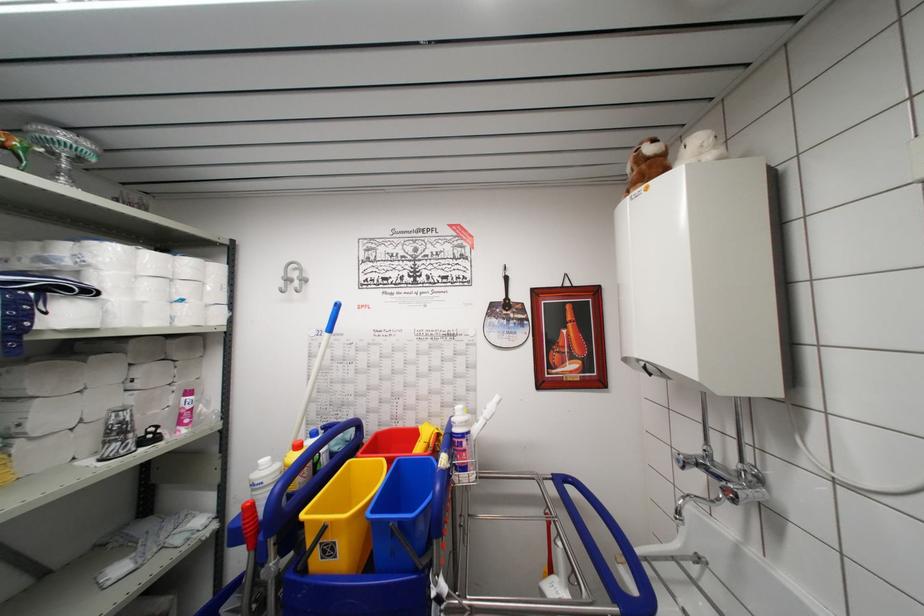
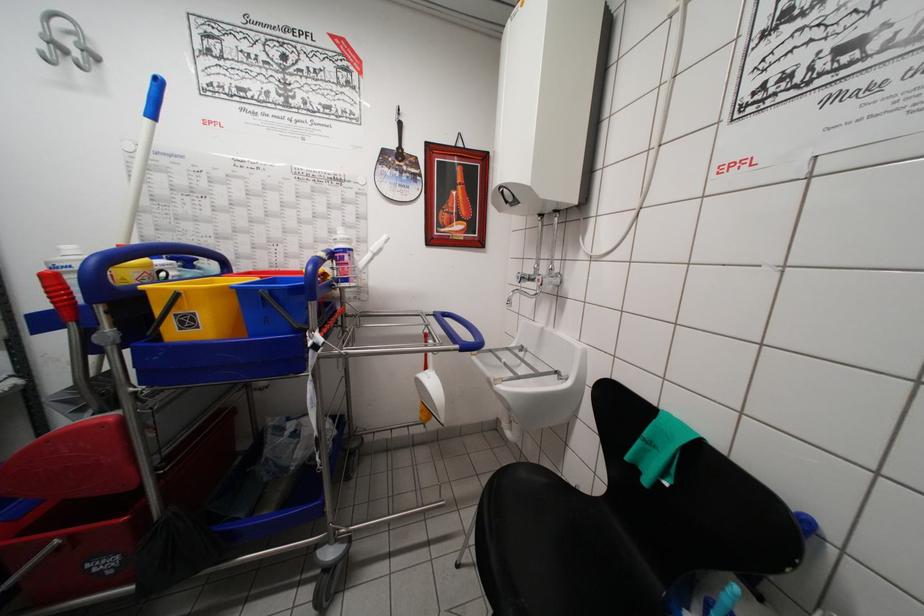
The point at (331,339) is marked in the first image. Where is the corresponding point in the second image?

(151, 124)